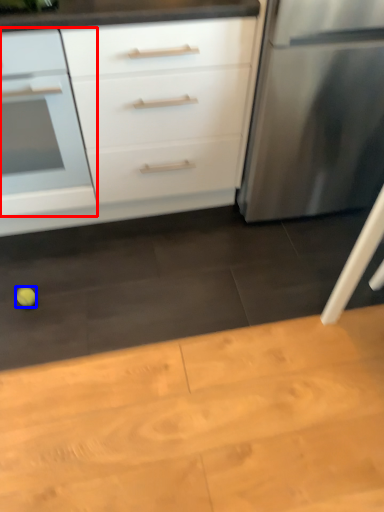
Question: Among these objects, which one is nearest to the camera, drawer (highlighted by a red box) or lime (highlighted by a blue box)?

Choices:
 (A) drawer
 (B) lime

Answer: (A)